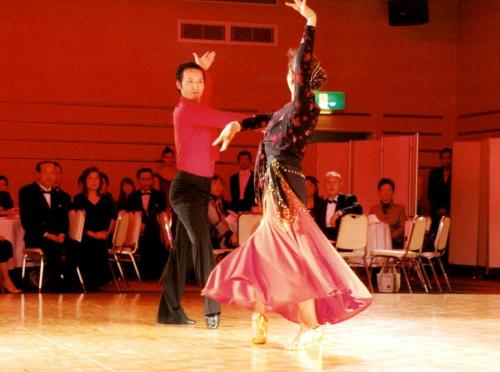
The height and width of the screenshot is (372, 500). Find the location of `ballroom floor`. ballroom floor is located at coordinates (124, 339).